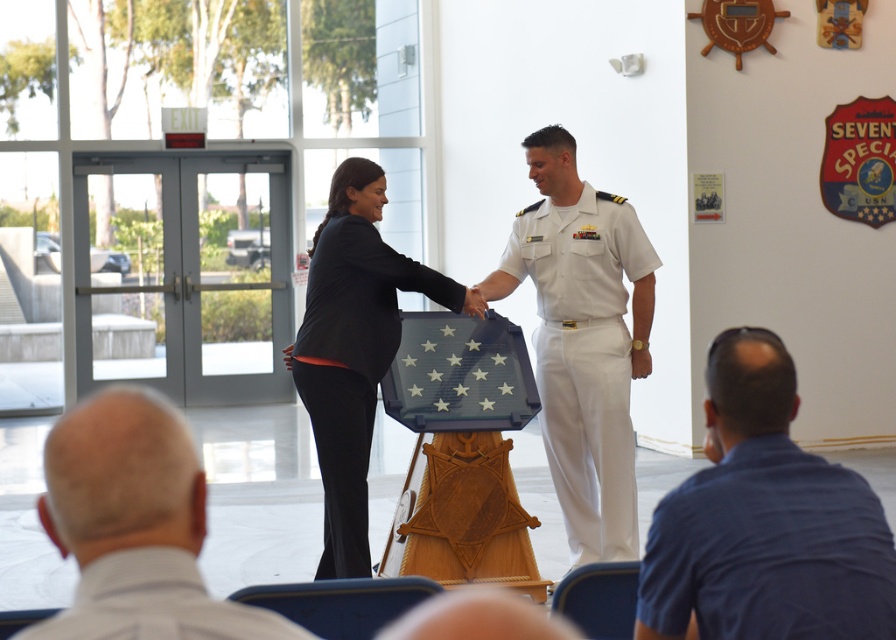
You are an observer standing in front of the scene. You notice the blue shirt at lower right and the khaki fabric uniform at lower left. Which object is closer to you?

The blue shirt at lower right is closer to you because the khaki fabric uniform at lower left is behind it.

You are organizing a charity event and need to decide which clothing item to donate. The blue shirt at lower right and the white cotton uniform at center are available. Based on their sizes, which one should you choose if you want to donate the larger item?

The white cotton uniform at center is larger than the blue shirt at lower right, so you should donate the white cotton uniform at center.